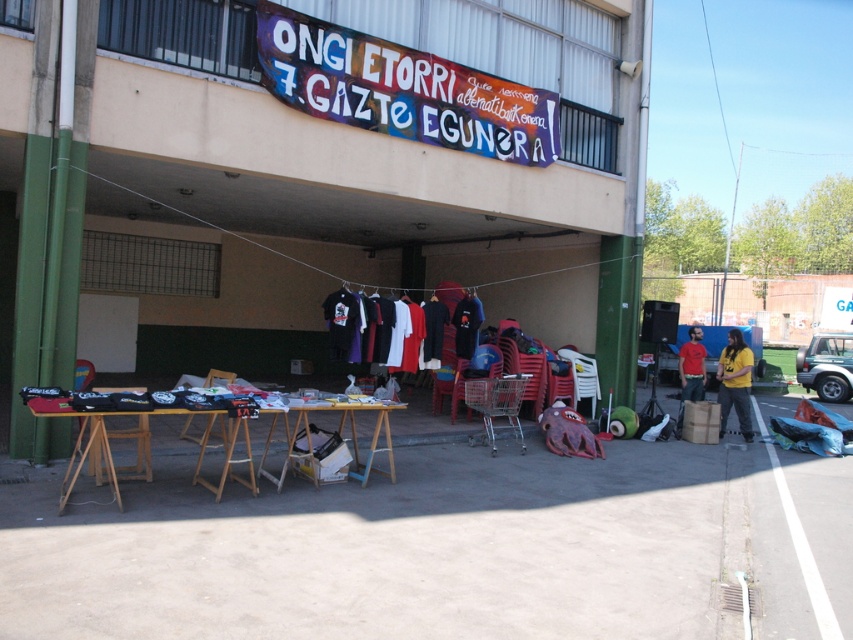
Measure the distance from wooden table at lower center to red matte t-shirt at right.

wooden table at lower center and red matte t-shirt at right are 27.49 feet apart.

Is wooden table at lower center below red matte t-shirt at right?

Indeed, wooden table at lower center is positioned under red matte t-shirt at right.

This screenshot has height=640, width=853. What do you see at coordinates (222, 440) in the screenshot?
I see `wooden table at lower center` at bounding box center [222, 440].

Find the location of a particular element. wooden table at lower center is located at coordinates (222, 440).

Can you confirm if wooden table at center is positioned to the right of red matte t-shirt at right?

Incorrect, wooden table at center is not on the right side of red matte t-shirt at right.

Does wooden table at center have a lesser width compared to red matte t-shirt at right?

No, wooden table at center is not thinner than red matte t-shirt at right.

Is point (384, 403) positioned after point (689, 348)?

No, it is in front of (689, 348).

Where is `wooden table at center`? The image size is (853, 640). wooden table at center is located at coordinates (340, 435).

Which is below, wooden table at lower center or wooden table at center?

wooden table at center is below.

Between point (364, 480) and point (373, 403), which one is positioned behind?

The point (364, 480) is behind.

You are a GUI agent. You are given a task and a screenshot of the screen. Output one action in this format:
    pyautogui.click(x=<x>, y=<y>)
    Task: Click on the wooden table at lower center
    Image resolution: width=853 pixels, height=640 pixels.
    Given the screenshot: What is the action you would take?
    pyautogui.click(x=222, y=440)